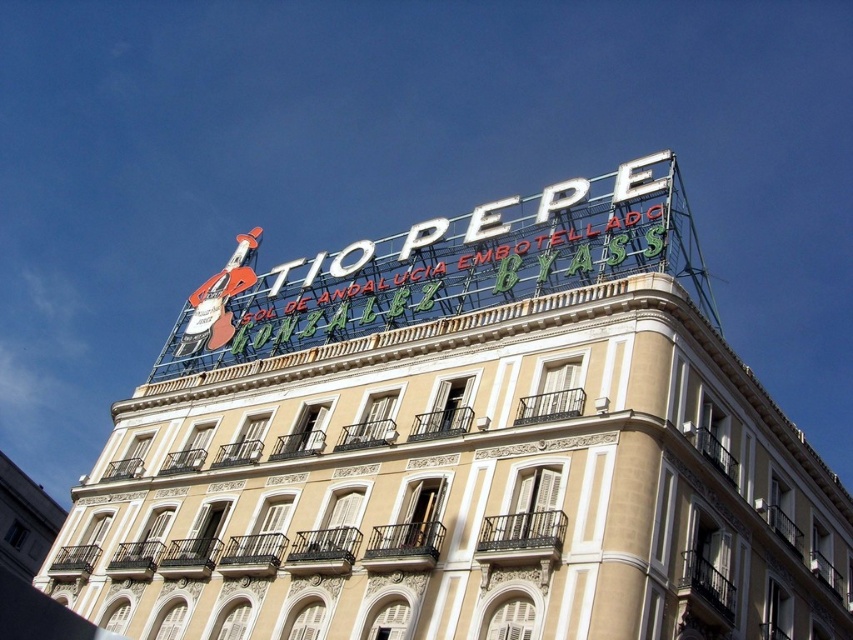
You are a delivery person standing 10 meters away from the beige stone building at center. You need to place a ladder to reach the white metallic sign at upper center. Can you estimate if the ladder you have, which is 12 meters long, will be sufficient to reach the sign from the ground?

The distance between the beige stone building at center and the white metallic sign at upper center is 13.46 meters. Since the ladder is only 12 meters long, it will not be long enough to reach the sign from the ground.

You are standing at a viewpoint 30 meters away from the beige stone building at center. Can you safely approach the building to take a closer look without exceeding the recommended safety distance of 30 meters?

The distance between you and the beige stone building at center is 31.75 meters, which is slightly beyond the recommended safety distance of 30 meters. Therefore, you can safely approach the building to take a closer look as you are already within the safe range.

You are an architect analyzing the facade of the beige stone building at center and the white metallic sign at upper center. Which object takes up more visual space on the building facade?

The white metallic sign at upper center occupies more visual space on the building facade than the beige stone building at center, as it is stated that the beige stone building at center occupies less space than the white metallic sign at upper center.